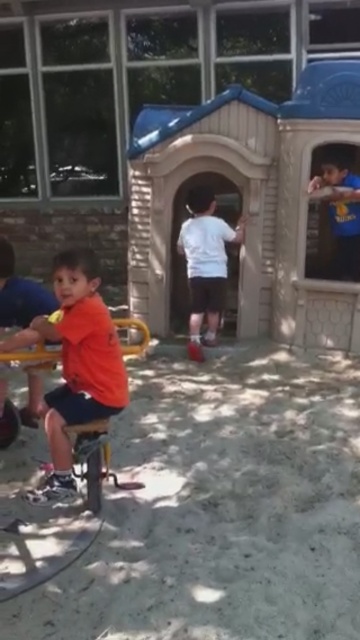
Question: Does orange matte shirt at left come behind orange matte shirt at lower left?

Choices:
 (A) no
 (B) yes

Answer: (A)

Question: Which object is closer to the camera taking this photo?

Choices:
 (A) orange matte shirt at left
 (B) white matte shirt at center
 (C) orange matte shirt at lower left
 (D) blue matte shirt at upper right

Answer: (A)

Question: Does white matte shirt at center appear on the left side of orange matte shirt at lower left?

Choices:
 (A) yes
 (B) no

Answer: (B)

Question: Which point appears closest to the camera in this image?

Choices:
 (A) (52, 300)
 (B) (122, 369)
 (C) (327, 252)

Answer: (B)

Question: Which point is closer to the camera taking this photo?

Choices:
 (A) (209, 208)
 (B) (354, 253)

Answer: (A)

Question: Can you confirm if white matte shirt at center is positioned to the right of orange matte shirt at lower left?

Choices:
 (A) yes
 (B) no

Answer: (A)